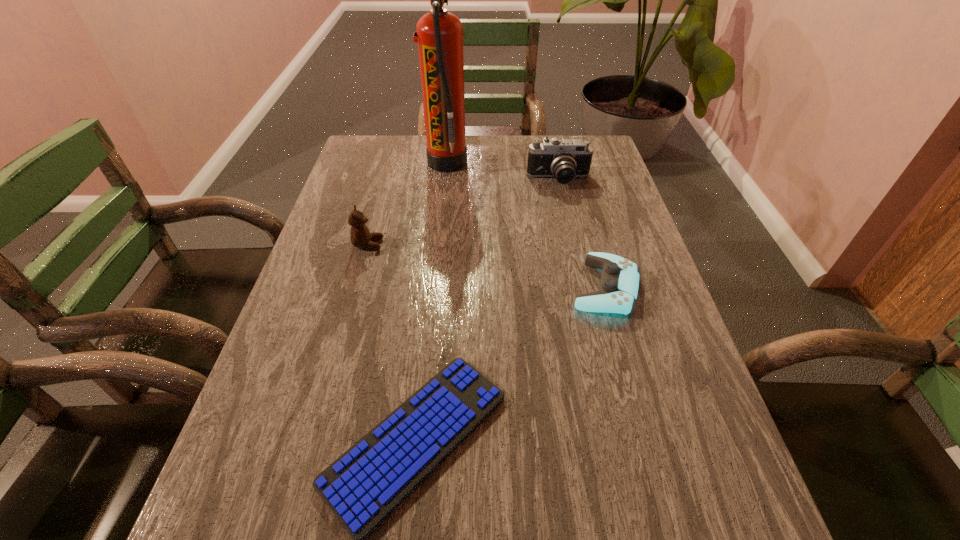
Image resolution: width=960 pixels, height=540 pixels. I want to click on free space that satisfies the following two spatial constraints: 1. on the front-facing side of the camera; 2. on the right side of the control, so click(583, 287).